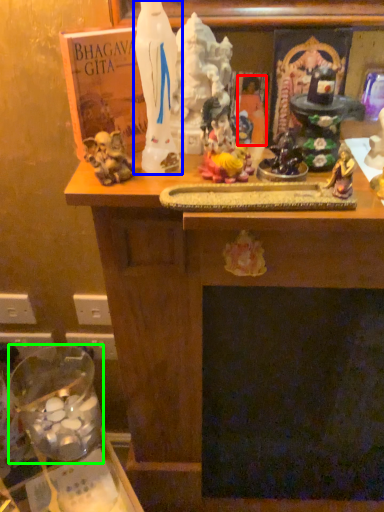
Question: Considering the real-world distances, which object is closest to person (highlighted by a red box)? statue (highlighted by a blue box) or glass jar (highlighted by a green box).

Choices:
 (A) statue
 (B) glass jar

Answer: (A)